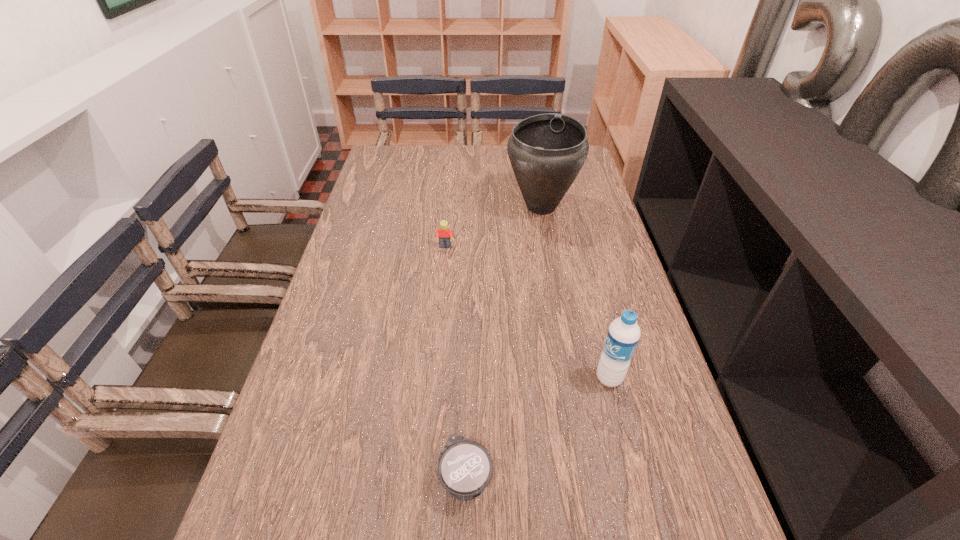
Identify the location of the farthest object. (547, 151).

Where is `the tallest object`? The height and width of the screenshot is (540, 960). the tallest object is located at coordinates (547, 151).

Image resolution: width=960 pixels, height=540 pixels. Find the location of `water bottle`. water bottle is located at coordinates (623, 334).

Find the location of `the third farthest object`. the third farthest object is located at coordinates (623, 334).

Where is `the third nearest object`? This screenshot has width=960, height=540. the third nearest object is located at coordinates (444, 234).

Locate an element on the screen. This screenshot has height=540, width=960. Lego is located at coordinates (444, 234).

This screenshot has height=540, width=960. I want to click on the nearest object, so click(x=465, y=467).

Locate an element on the screen. The height and width of the screenshot is (540, 960). yogurt is located at coordinates (465, 467).

The height and width of the screenshot is (540, 960). I want to click on vacant position located on the front of the tallest object, so click(557, 292).

The image size is (960, 540). I want to click on vacant region located on the label of the water bottle, so click(522, 378).